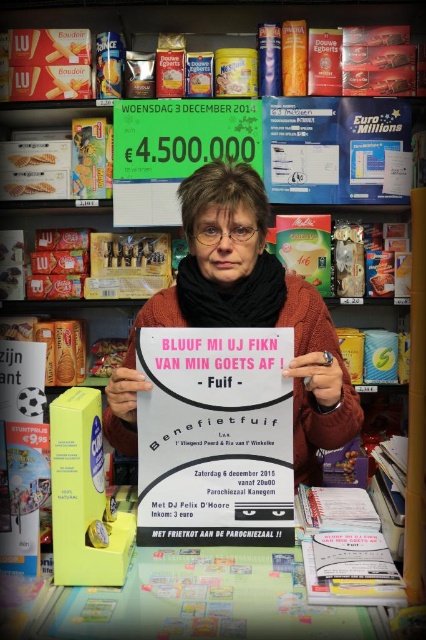
Does pink paper poster at center have a lesser height compared to matte white poster at center?

Indeed, pink paper poster at center has a lesser height compared to matte white poster at center.

Does point (282, 404) come behind point (221, 176)?

No.

This screenshot has width=426, height=640. I want to click on pink paper poster at center, so click(215, 436).

Who is taller, pink paper poster at center or white paper book at lower center?

pink paper poster at center is taller.

What do you see at coordinates (215, 436) in the screenshot? I see `pink paper poster at center` at bounding box center [215, 436].

You are a GUI agent. You are given a task and a screenshot of the screen. Output one action in this format:
    pyautogui.click(x=<x>, y=<y>)
    Task: Click on the pink paper poster at center
    
    Given the screenshot: What is the action you would take?
    pyautogui.click(x=215, y=436)

Does matte white poster at center have a lesser width compared to white paper book at lower center?

Incorrect, matte white poster at center's width is not less than white paper book at lower center's.

Is point (120, 422) positioned behind point (377, 580)?

Yes, it is behind point (377, 580).

This screenshot has height=640, width=426. What are the coordinates of `matte white poster at center` in the screenshot? It's located at (244, 314).